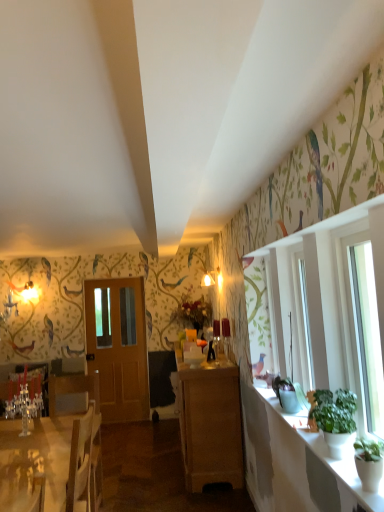
Question: Relative to white glossy counter top at right, is green matte plant at right in front or behind?

Choices:
 (A) behind
 (B) front

Answer: (A)

Question: Considering the relative positions of green matte plant at right and white glossy counter top at right in the image provided, is green matte plant at right to the left or to the right of white glossy counter top at right?

Choices:
 (A) right
 (B) left

Answer: (A)

Question: Based on their relative distances, which object is farther from the green matte plant at right?

Choices:
 (A) wooden armchair at left
 (B) wooden cabinet at center
 (C) white glossy desk at lower left
 (D) light brown wooden door at center
 (E) white glossy counter top at right

Answer: (D)

Question: Estimate the real-world distances between objects in this image. Which object is closer to the green matte plant at right?

Choices:
 (A) white glossy desk at lower left
 (B) green leafy plant at right
 (C) white glossy counter top at right
 (D) wooden armchair at left
 (E) wooden cabinet at center

Answer: (B)